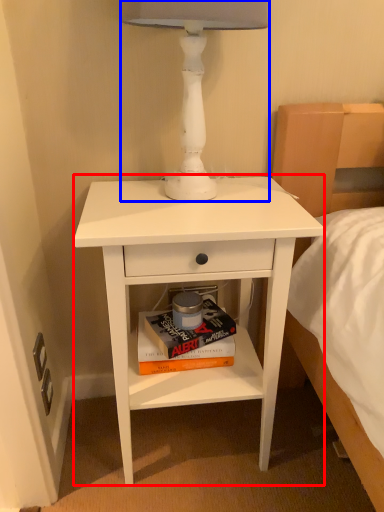
Question: Which point is further to the camera, nightstand (highlighted by a red box) or table lamp (highlighted by a blue box)?

Choices:
 (A) nightstand
 (B) table lamp

Answer: (A)